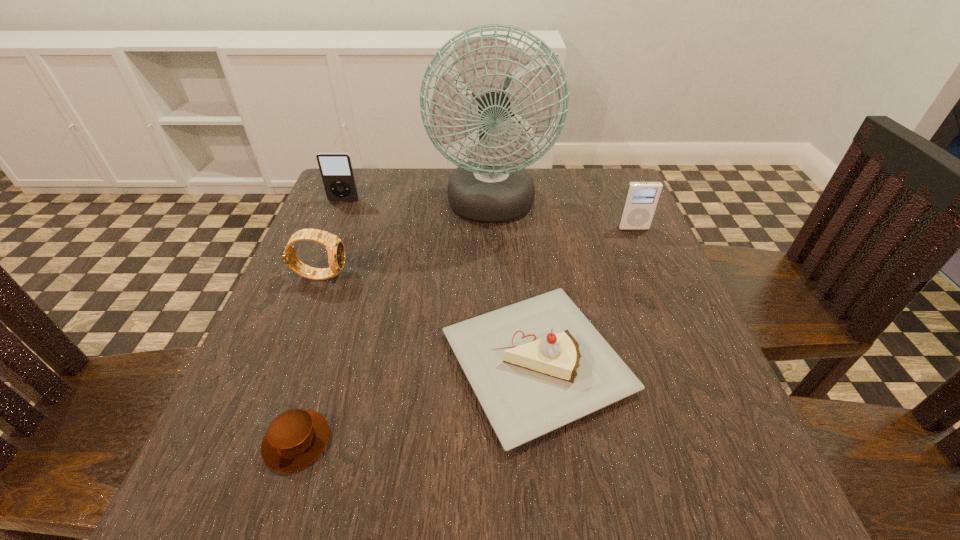
I want to click on iPod that is at the right edge, so click(641, 199).

The height and width of the screenshot is (540, 960). I want to click on cake at the right edge, so click(537, 365).

What are the coordinates of `object located in the far left corner section of the desktop` in the screenshot? It's located at (336, 169).

Where is `object positioned at the near left corner`? The width and height of the screenshot is (960, 540). object positioned at the near left corner is located at coordinates (x=296, y=438).

Image resolution: width=960 pixels, height=540 pixels. In order to click on object located in the near right corner section of the desktop in this screenshot , I will do `click(537, 365)`.

Locate an element on the screen. The image size is (960, 540). free space at the far edge is located at coordinates (541, 197).

Locate an element on the screen. vacant space at the near edge is located at coordinates (451, 471).

Identify the location of free point at the left edge. The width and height of the screenshot is (960, 540). (347, 289).

The width and height of the screenshot is (960, 540). Identify the location of vacant position at the right edge of the desktop. (636, 315).

Identify the location of vacant space at the far right corner. (596, 173).